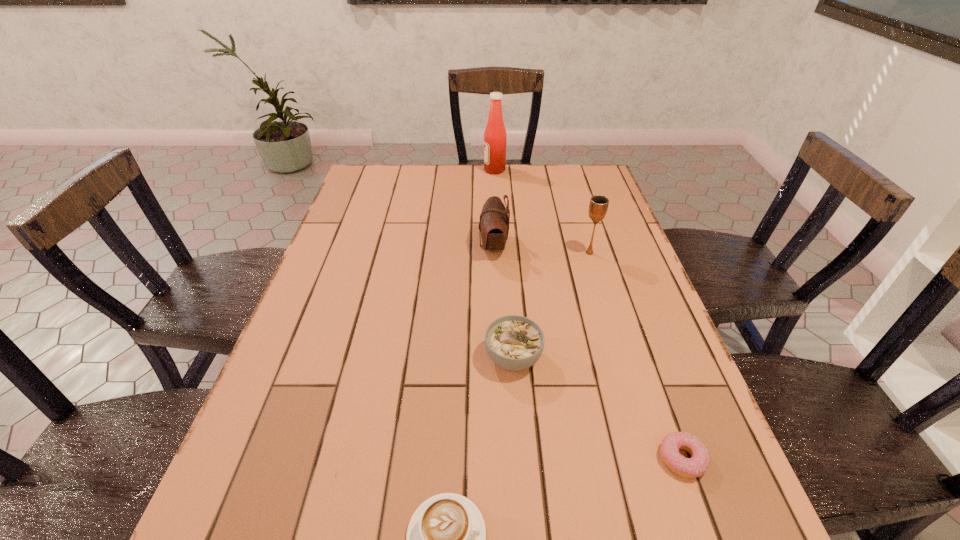
At what (x,y) coordinates should I click in order to perform the action: click on vacant space situated 0.120m on the front-facing side of the farthest object. Please return your answer as a coordinate pair (x, y). This screenshot has height=540, width=960. Looking at the image, I should click on (450, 170).

Locate an element on the screen. This screenshot has height=540, width=960. vacant space located 0.340m on the front of the second tallest object is located at coordinates pos(621,356).

This screenshot has width=960, height=540. I want to click on free spot located with the flap open on the pouch, so click(x=450, y=246).

What are the coordinates of `vacant space located 0.160m with the flap open on the pouch` in the screenshot? It's located at (421, 246).

Where is `free region located with the flap open on the pouch`? This screenshot has height=540, width=960. free region located with the flap open on the pouch is located at coordinates (429, 246).

Locate an element on the screen. This screenshot has width=960, height=540. free location located on the left of the soup bowl is located at coordinates (335, 357).

At what (x,y) coordinates should I click in order to perform the action: click on free point located 0.240m on the left of the second nearest object. Please return your answer as a coordinate pair (x, y). Looking at the image, I should click on (522, 459).

Where is `object that is positioned at the far edge`? object that is positioned at the far edge is located at coordinates (495, 136).

The width and height of the screenshot is (960, 540). Identify the location of chalice located in the right edge section of the desktop. (598, 206).

Where is `doughnut at the right edge`? The width and height of the screenshot is (960, 540). doughnut at the right edge is located at coordinates (698, 464).